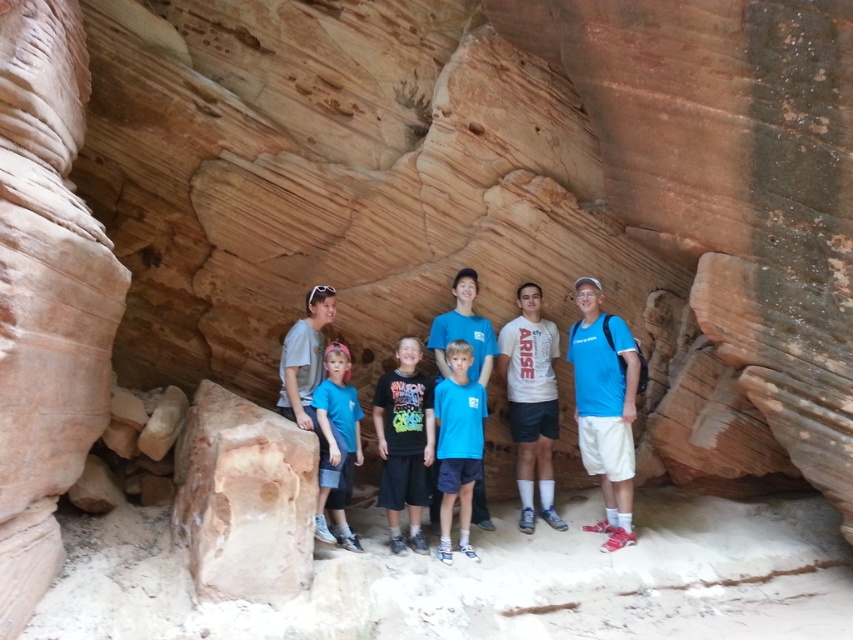
Question: Is smooth sandstone rock at center further to the viewer compared to white cotton t-shirt at center?

Choices:
 (A) no
 (B) yes

Answer: (A)

Question: Which object is farther from the camera taking this photo?

Choices:
 (A) blue cotton shirt at center
 (B) black matte t-shirt at center
 (C) white cotton t-shirt at center

Answer: (C)

Question: Does blue cotton shirt at center come in front of blue t-shirt at center?

Choices:
 (A) no
 (B) yes

Answer: (A)

Question: From the image, what is the correct spatial relationship of black matte t-shirt at center in relation to blue matte shirt at center?

Choices:
 (A) above
 (B) below

Answer: (A)

Question: Which point is closer to the camera taking this photo?

Choices:
 (A) (396, 484)
 (B) (596, 376)
 (C) (554, 397)
 (D) (517, 448)

Answer: (A)

Question: Which of these objects is positioned farthest from the blue t-shirt at center?

Choices:
 (A) black matte t-shirt at center
 (B) blue matte shirt at center
 (C) blue cotton t-shirts at center
 (D) blue cotton shirt at center

Answer: (C)